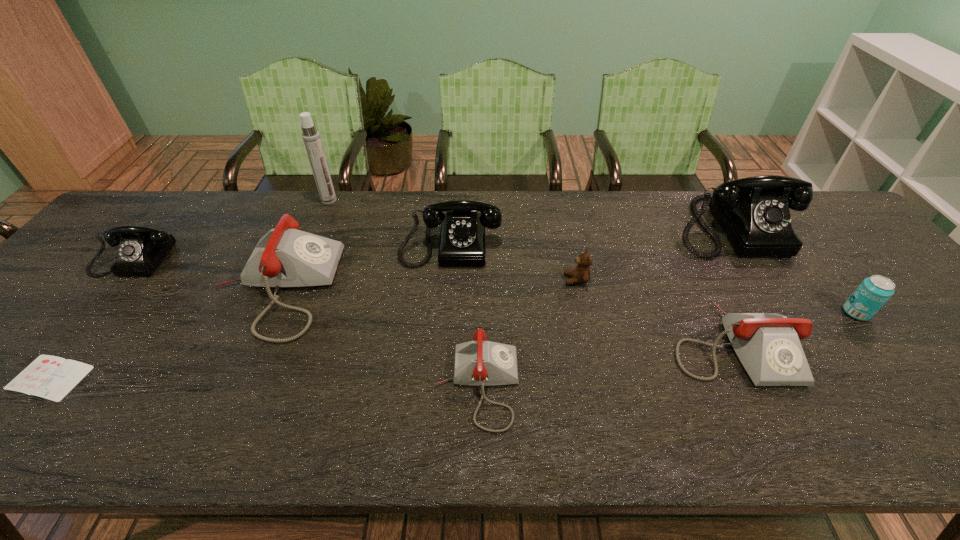
The width and height of the screenshot is (960, 540). What are the coordinates of `vacant space situated 0.160m on the left of the beer can` in the screenshot? It's located at (779, 313).

At what (x,y) coordinates should I click in order to perform the action: click on vacant area situated 0.210m at the face of the seventh object from left to right. Please return your answer as a coordinate pair (x, y). The image size is (960, 540). Looking at the image, I should click on (485, 280).

Locate an element on the screen. The image size is (960, 540). vacant space situated at the face of the seventh object from left to right is located at coordinates (530, 280).

The height and width of the screenshot is (540, 960). Find the location of `free space located 0.090m at the face of the seventh object from left to right`. free space located 0.090m at the face of the seventh object from left to right is located at coordinates point(530,280).

This screenshot has width=960, height=540. In order to click on free location located 0.130m on the dial of the second red telephone from right to left in this screenshot , I will do `click(579, 385)`.

Where is `aerosol can positioned at the far edge`? The image size is (960, 540). aerosol can positioned at the far edge is located at coordinates (311, 137).

Identify the location of object at the near edge. The height and width of the screenshot is (540, 960). (481, 363).

What are the coordinates of `object at the left edge` in the screenshot? It's located at (141, 249).

The image size is (960, 540). What are the coordinates of `object situated at the right edge` in the screenshot? It's located at (875, 291).

Find the location of a particular element. This screenshot has width=960, height=540. object at the far left corner is located at coordinates (141, 249).